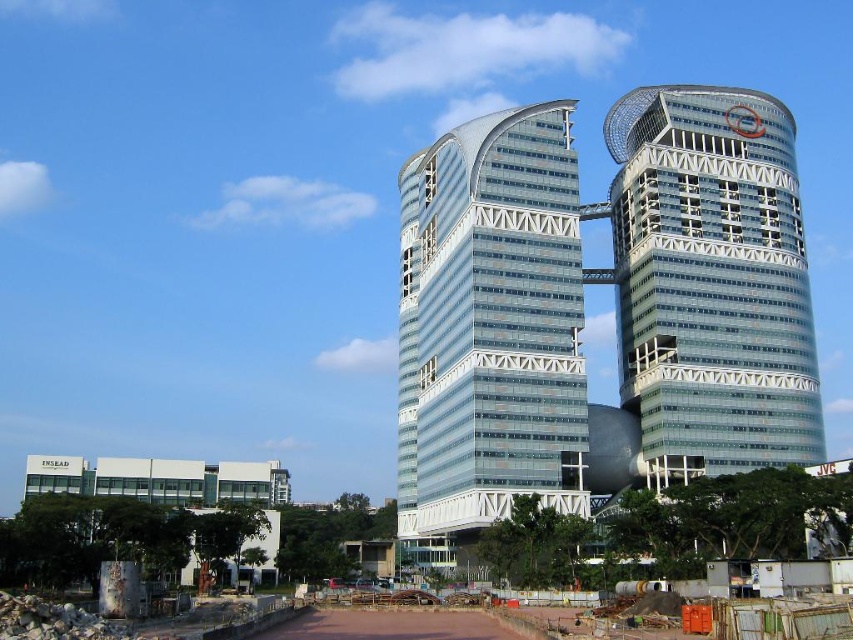
Question: Which of the following is the farthest from the observer?

Choices:
 (A) (756, 252)
 (B) (477, 172)

Answer: (A)

Question: Is transparent glass building at center thinner than transparent glass tower at upper right?

Choices:
 (A) no
 (B) yes

Answer: (B)

Question: Is transparent glass building at center to the right of transparent glass tower at upper right from the viewer's perspective?

Choices:
 (A) no
 (B) yes

Answer: (A)

Question: Which object appears farthest from the camera in this image?

Choices:
 (A) transparent glass building at center
 (B) transparent glass tower at upper right

Answer: (B)

Question: Which object appears closest to the camera in this image?

Choices:
 (A) transparent glass tower at upper right
 (B) transparent glass building at center

Answer: (B)

Question: Does transparent glass building at center appear on the left side of transparent glass tower at upper right?

Choices:
 (A) yes
 (B) no

Answer: (A)